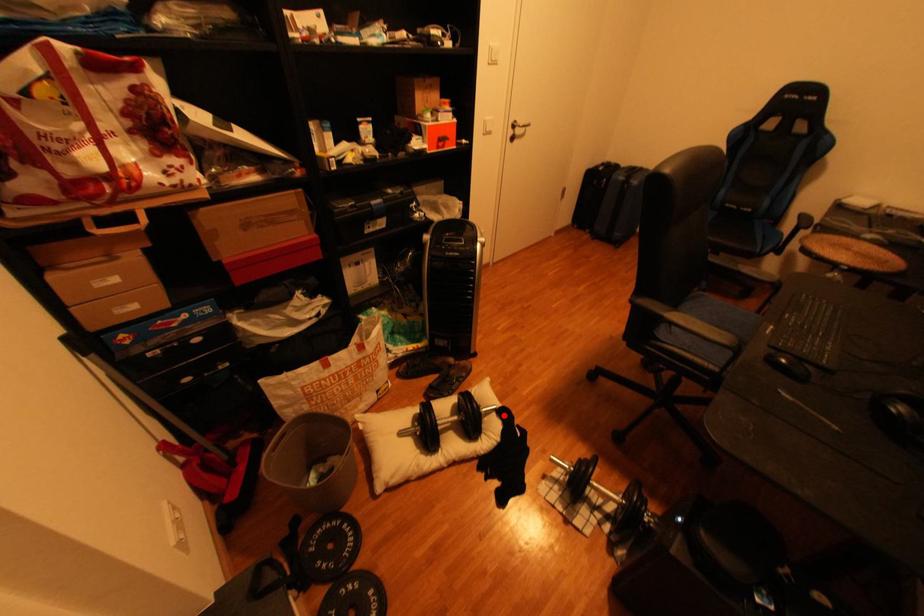
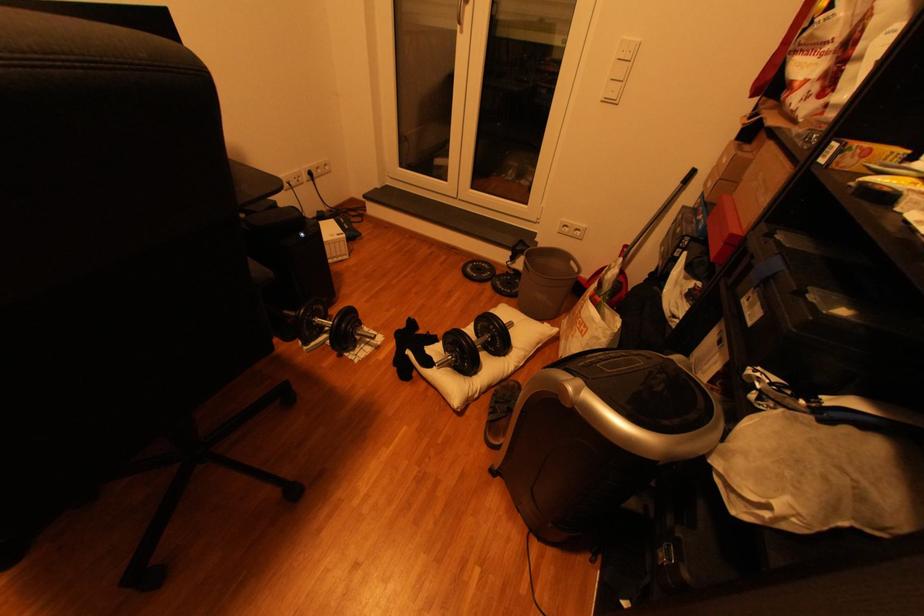
Question: I am providing you with two images of the same scene from different viewpoints. Image1 has a red point marked. In image2, the corresponding 3D location appears at what relative position? Reply with the corresponding letter.

Choices:
 (A) Closer
 (B) Farther

Answer: (B)